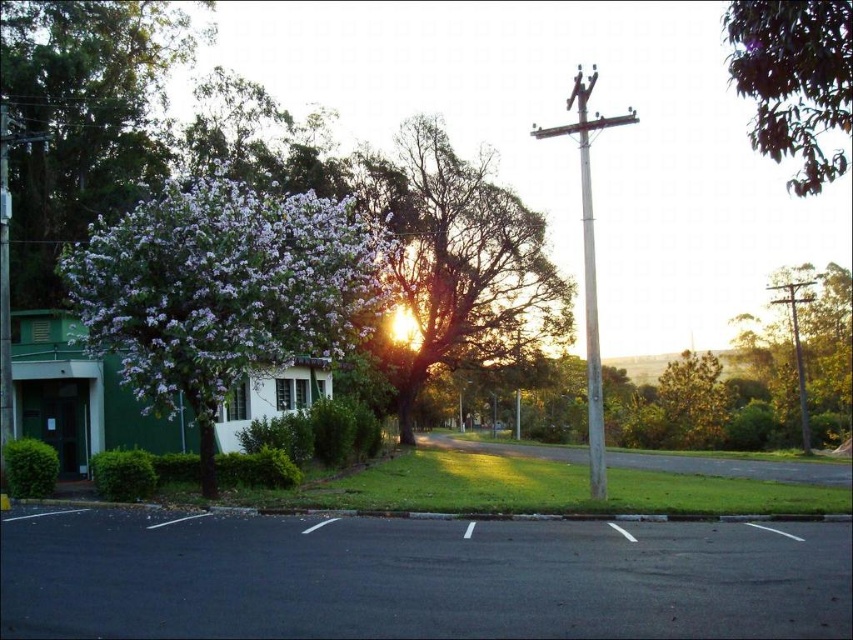
You are a painter setting up your easel to capture the suburban scene. You want to ensure both the purple matte tree at left and the silver metallic telegraph pole at center right are visible in your painting. Given their sizes, which object should you place closer to the center of your canvas to maintain balance?

The purple matte tree at left is smaller than the silver metallic telegraph pole at center right. To balance the composition, you should place the smaller purple matte tree at left closer to the center of the canvas so it visually complements the larger pole on the edge.